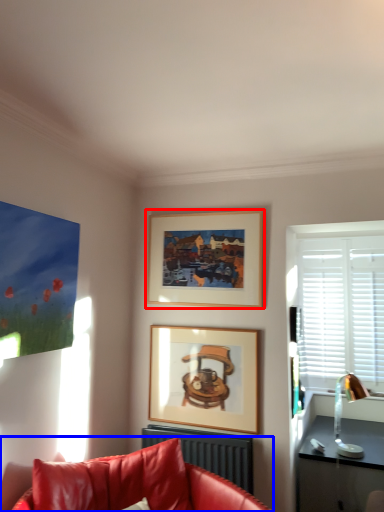
Question: Which object appears farthest to the camera in this image, picture frame (highlighted by a red box) or studio couch (highlighted by a blue box)?

Choices:
 (A) picture frame
 (B) studio couch

Answer: (A)